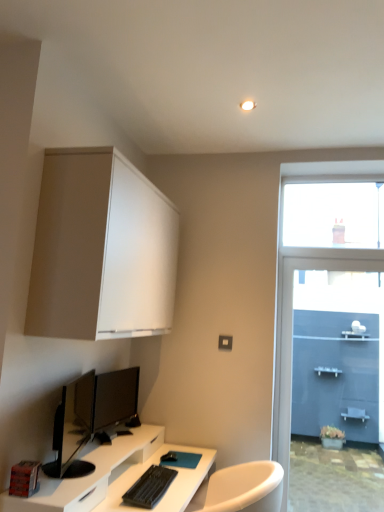
What are the coordinates of `free point above blue matte wall at right (from a real-world perspective)` in the screenshot? It's located at (343, 241).